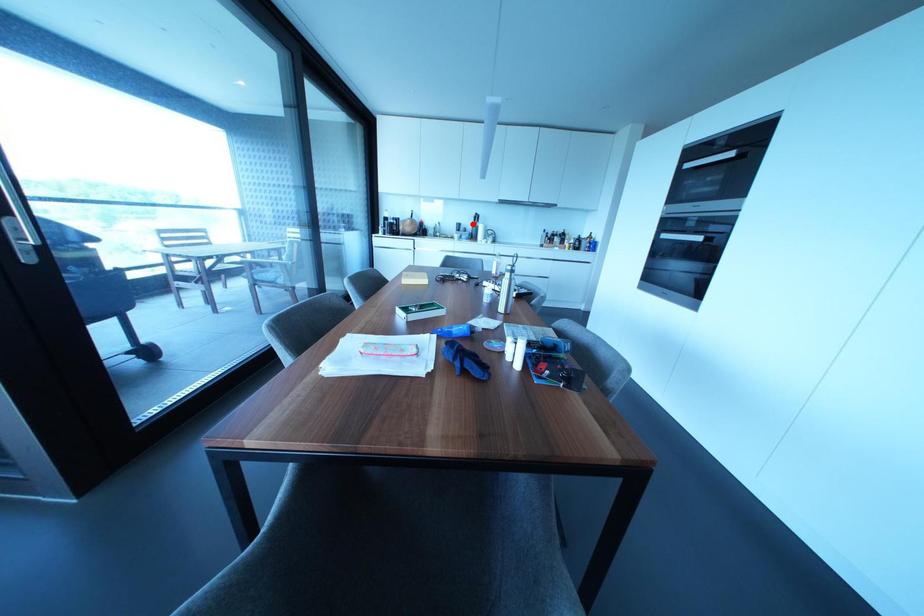
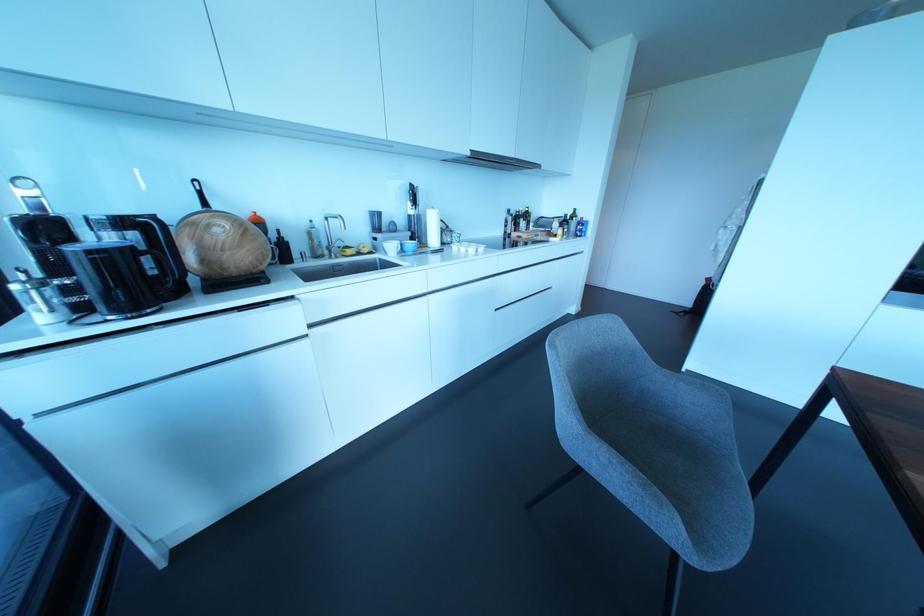
Question: I am providing you with two images of the same scene from different viewpoints. A red point is marked on the first image. At the location where the point appears in image 1, is it still visible in image 2?

Choices:
 (A) Yes
 (B) No

Answer: (A)